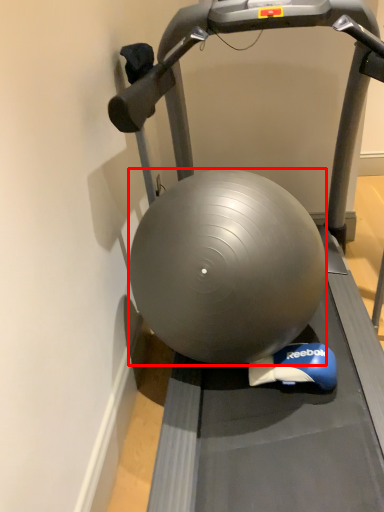
Question: Considering the relative positions of ball (annotated by the red box) and treadmill in the image provided, where is ball (annotated by the red box) located with respect to the staircase?

Choices:
 (A) left
 (B) right

Answer: (A)